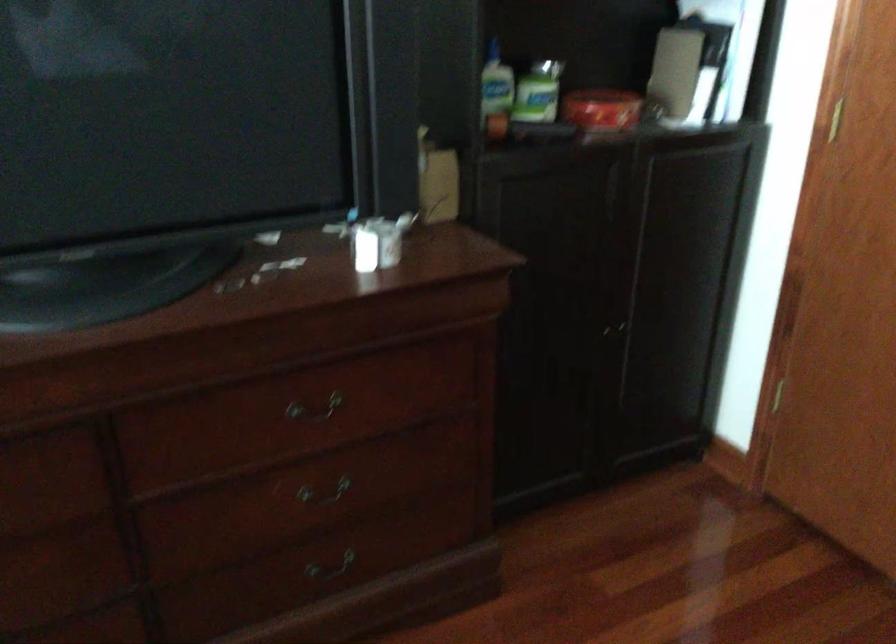
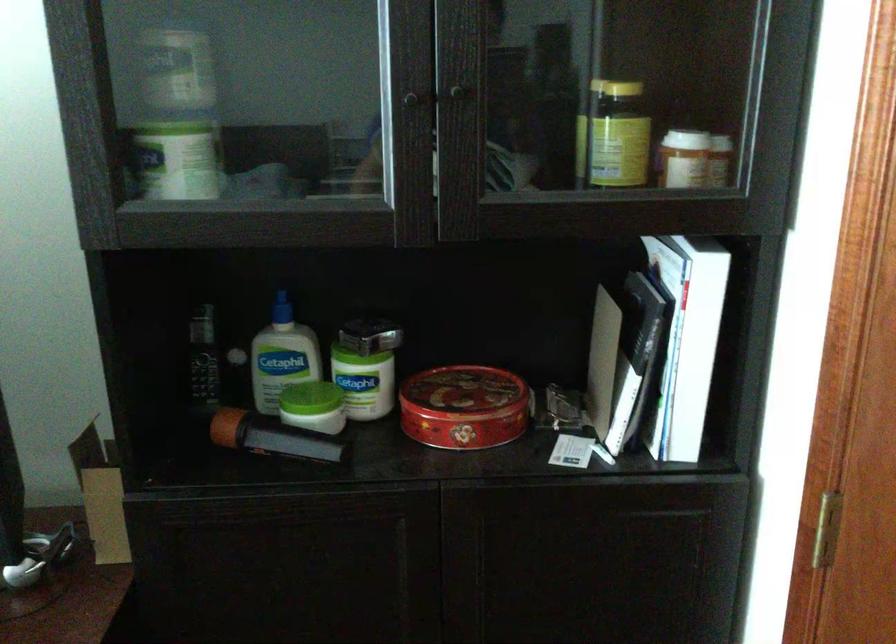
Find the pixel in the second image that matches pixel 445 82 in the first image.

(202, 357)